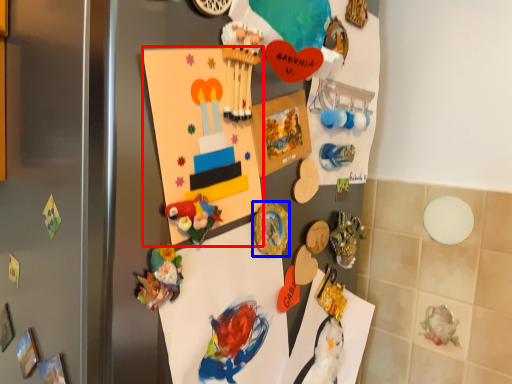
Question: Which of the following is the closest to the observer, postcard (highlighted by a red box) or button (highlighted by a blue box)?

Choices:
 (A) postcard
 (B) button

Answer: (A)